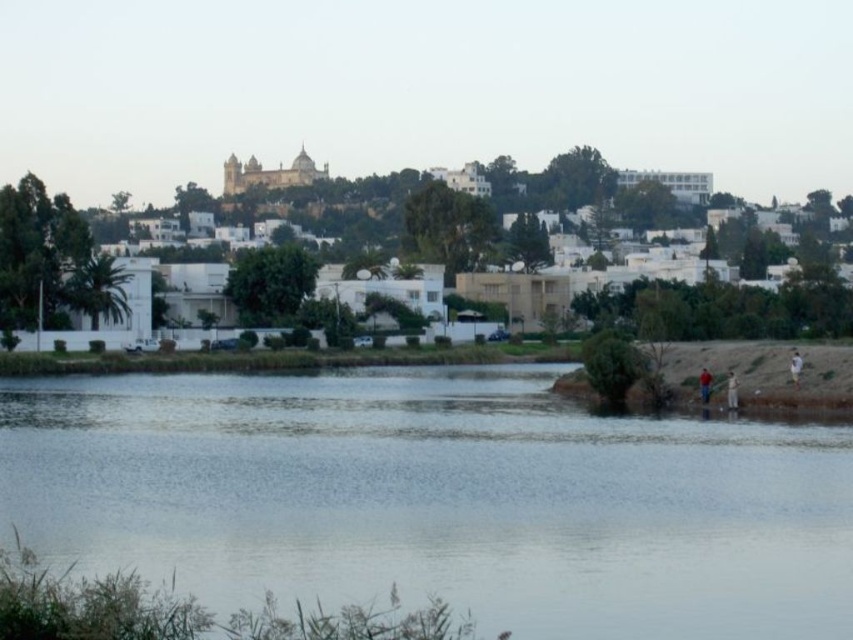
Question: Estimate the real-world distances between objects in this image. Which object is farther from the light brown wooden stick at lower right?

Choices:
 (A) clear water at lower center
 (B) brown leather jacket at lower right

Answer: (A)

Question: Which of the following is the closest to the observer?

Choices:
 (A) (792, 369)
 (B) (730, 387)
 (C) (706, 380)
 (D) (679, 476)

Answer: (D)

Question: Does light brown wooden stick at lower right have a greater width compared to white cotton shirt at lower right?

Choices:
 (A) no
 (B) yes

Answer: (B)

Question: Is light brown wooden stick at lower right bigger than brown leather jacket at lower right?

Choices:
 (A) no
 (B) yes

Answer: (A)

Question: Does brown leather jacket at lower right have a smaller size compared to white cotton shirt at lower right?

Choices:
 (A) yes
 (B) no

Answer: (B)

Question: Which of the following is the farthest from the observer?

Choices:
 (A) clear water at lower center
 (B) light brown wooden stick at lower right
 (C) brown leather jacket at lower right
 (D) white cotton shirt at lower right

Answer: (C)